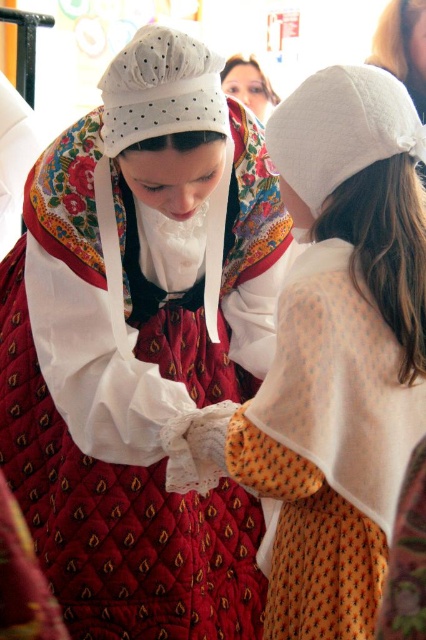
Question: Does quilted red dress at center appear under matte white lace at upper center?

Choices:
 (A) no
 (B) yes

Answer: (B)

Question: Which point appears farthest from the camera in this image?

Choices:
 (A) (420, 113)
 (B) (261, 72)

Answer: (B)

Question: Is white cotton bonnet at upper center below matte white lace at upper center?

Choices:
 (A) yes
 (B) no

Answer: (A)

Question: Which of the following is the farthest from the observer?

Choices:
 (A) quilted red dress at center
 (B) white cotton cap at upper center
 (C) matte white lace at upper center
 (D) white cotton bonnet at upper center

Answer: (C)

Question: Is white cotton bonnet at upper center to the left of matte white lace at upper center from the viewer's perspective?

Choices:
 (A) no
 (B) yes

Answer: (A)

Question: Among these objects, which one is nearest to the camera?

Choices:
 (A) white cotton cap at upper center
 (B) quilted red dress at center

Answer: (B)